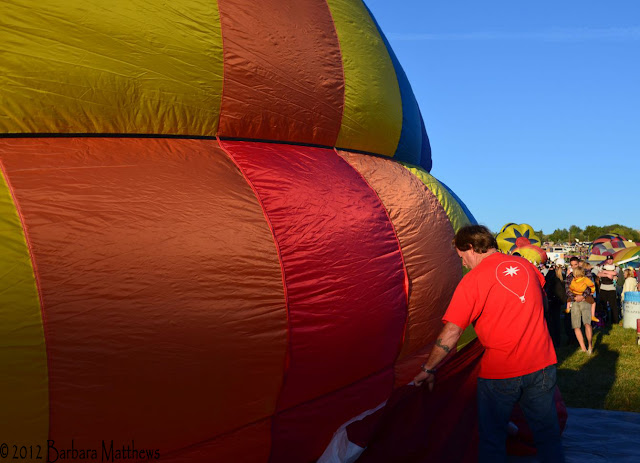
Where is `trashcan`? trashcan is located at coordinates (633, 306).